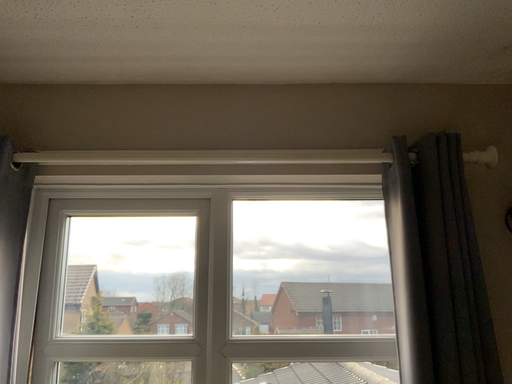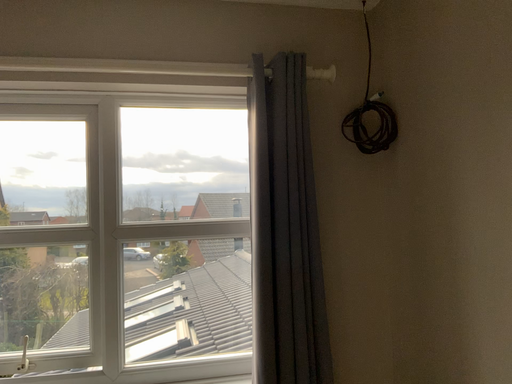
Question: How did the camera likely rotate when shooting the video?

Choices:
 (A) rotated left
 (B) rotated right

Answer: (B)